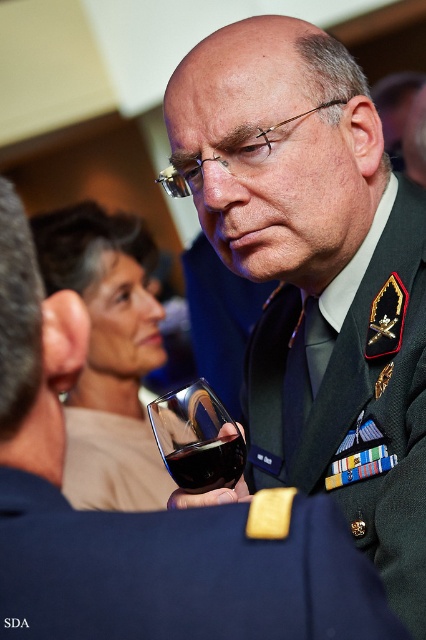
Question: Which object is positioned farthest from the navy blue fabric at center?

Choices:
 (A) dark red liquid at center
 (B) green military uniform at center
 (C) transparent glass at center

Answer: (B)

Question: Which point is farther from the camera taking this photo?

Choices:
 (A) (207, 476)
 (B) (226, 428)

Answer: (B)

Question: Can you confirm if navy blue fabric at center is positioned to the left of transparent glass at center?

Choices:
 (A) no
 (B) yes

Answer: (A)

Question: Is navy blue fabric at center wider than transparent glass at center?

Choices:
 (A) yes
 (B) no

Answer: (A)

Question: Estimate the real-world distances between objects in this image. Which object is farther from the dark red liquid at center?

Choices:
 (A) navy blue fabric at center
 (B) transparent glass at center

Answer: (A)

Question: Where is navy blue fabric at center located in relation to dark red liquid at center in the image?

Choices:
 (A) above
 (B) below

Answer: (A)